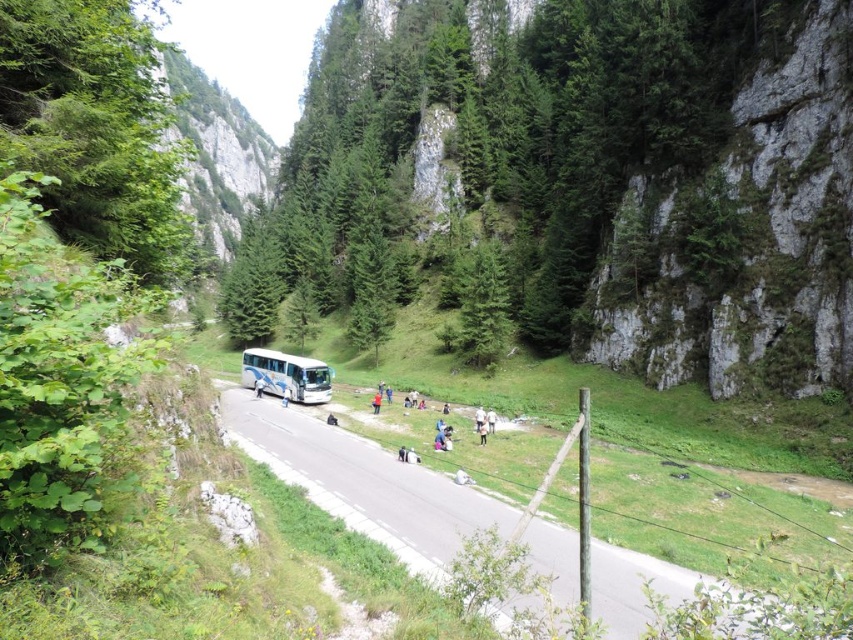
Is white asphalt road at center positioned at the back of white glossy tour bus at center?

That is False.

What do you see at coordinates (364, 483) in the screenshot? I see `white asphalt road at center` at bounding box center [364, 483].

I want to click on white asphalt road at center, so click(x=364, y=483).

This screenshot has height=640, width=853. What do you see at coordinates (96, 129) in the screenshot? I see `green leafy tree at left` at bounding box center [96, 129].

At what (x,y) coordinates should I click in order to perform the action: click on green leafy tree at left. Please return your answer as a coordinate pair (x, y). This screenshot has width=853, height=640. Looking at the image, I should click on (96, 129).

Where is `green leafy tree at left`? This screenshot has width=853, height=640. green leafy tree at left is located at coordinates (96, 129).

Which is below, green leafy tree at left or white asphalt road at center?

Positioned lower is white asphalt road at center.

Between green leafy tree at left and white asphalt road at center, which one appears on the left side from the viewer's perspective?

From the viewer's perspective, green leafy tree at left appears more on the left side.

Which is in front, point (82, 38) or point (259, 449)?

Positioned in front is point (82, 38).

You are a GUI agent. You are given a task and a screenshot of the screen. Output one action in this format:
    pyautogui.click(x=<x>, y=<y>)
    Task: Click on the green leafy tree at left
    
    Given the screenshot: What is the action you would take?
    pyautogui.click(x=96, y=129)